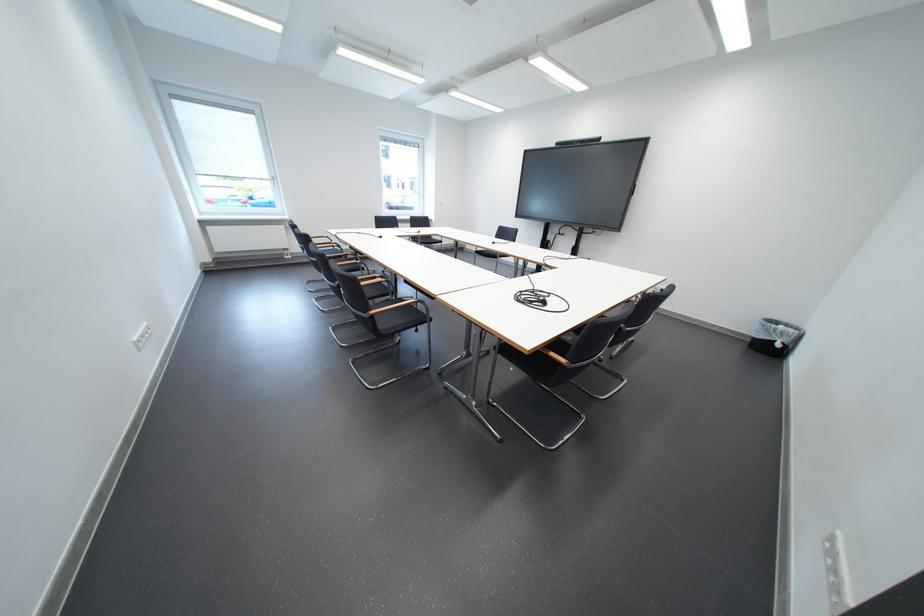
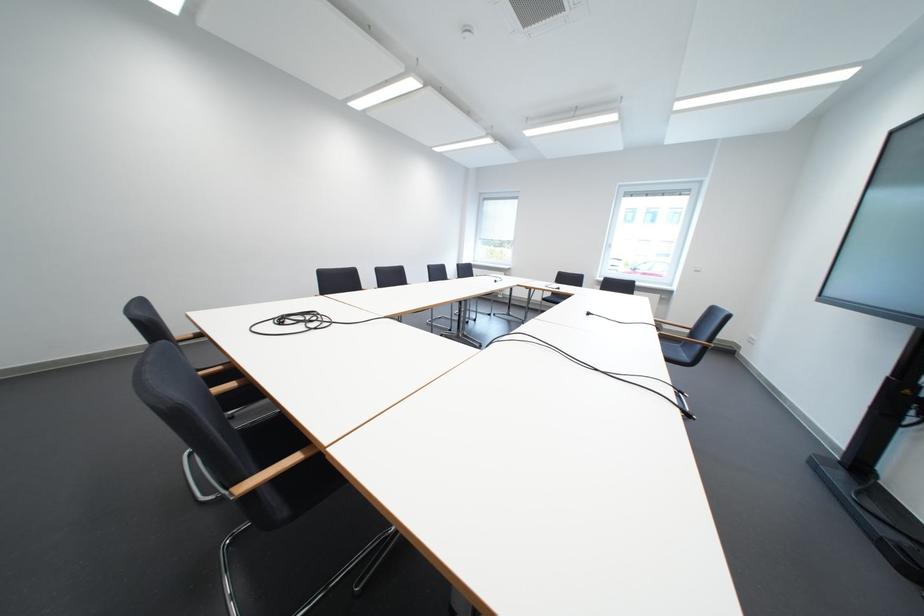
Locate, in the second image, the point that corresponds to the point at 505,245 in the first image.

(601, 315)